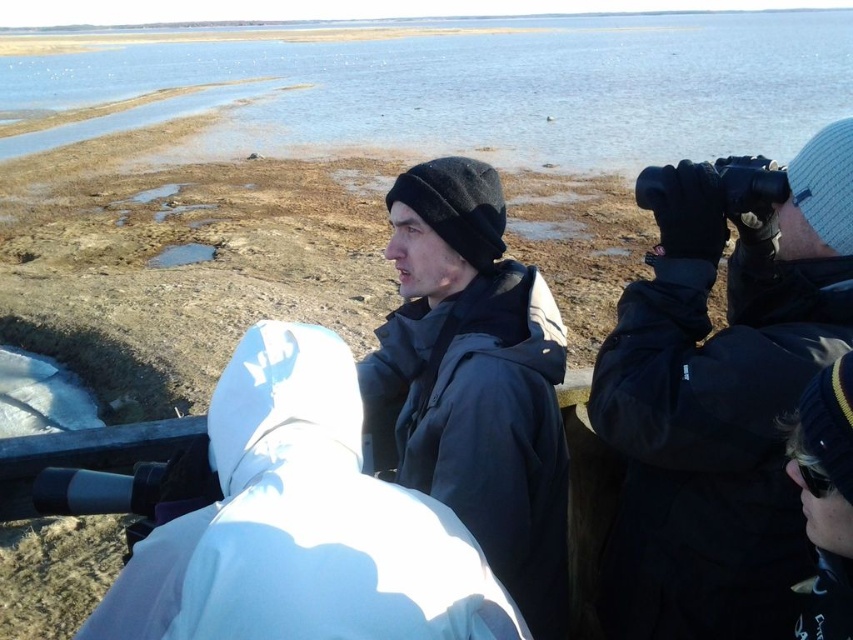
Is blue water at center below dark gray knit cap at center?

No, blue water at center is not below dark gray knit cap at center.

Is blue water at center positioned before dark gray knit cap at center?

No.

Is point (527, 147) closer to viewer compared to point (467, 268)?

That is False.

Image resolution: width=853 pixels, height=640 pixels. Identify the location of blue water at center. click(x=480, y=90).

Is blue water at center further to camera compared to knitted wool hat at lower right?

Yes, blue water at center is further from the viewer.

Does blue water at center appear on the left side of knitted wool hat at lower right?

No, blue water at center is not to the left of knitted wool hat at lower right.

Who is more forward, (579,35) or (804,413)?

Positioned in front is point (804,413).

Find the location of `blue water at center`. blue water at center is located at coordinates (480, 90).

Is blue water at center wider than black matte binoculars at upper right?

Yes.

Is point (753, 116) more distant than point (761, 362)?

Yes.

The height and width of the screenshot is (640, 853). I want to click on blue water at center, so (x=480, y=90).

Find the location of a particular element. blue water at center is located at coordinates (480, 90).